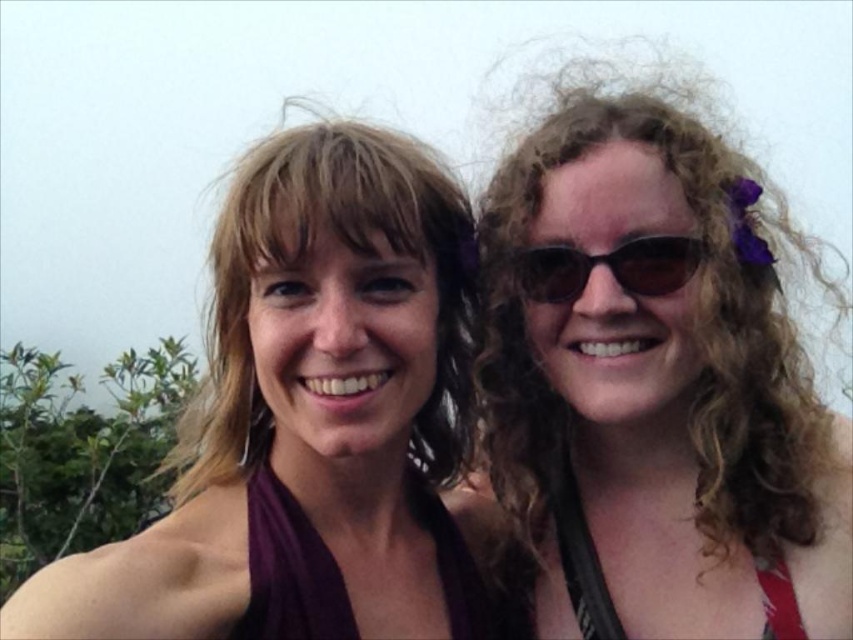
Based on the photo, does curly hair at center have a lesser height compared to black plastic sunglasses at right?

In fact, curly hair at center may be taller than black plastic sunglasses at right.

Does curly hair at center have a smaller size compared to black plastic sunglasses at right?

No.

Who is more forward, (503, 417) or (659, 296)?

Positioned in front is point (659, 296).

Locate an element on the screen. The height and width of the screenshot is (640, 853). curly hair at center is located at coordinates (654, 374).

Between curly hair at center and red fabric bikini top at right, which one appears on the right side from the viewer's perspective?

curly hair at center

Can you confirm if curly hair at center is positioned below red fabric bikini top at right?

No, curly hair at center is not below red fabric bikini top at right.

At what (x,y) coordinates should I click in order to perform the action: click on curly hair at center. Please return your answer as a coordinate pair (x, y). Looking at the image, I should click on (654, 374).

Can you confirm if matte purple dress at center is positioned above red fabric bikini top at right?

Yes.

From the picture: Who is lower down, matte purple dress at center or red fabric bikini top at right?

red fabric bikini top at right is lower down.

Who is more forward, (206, 445) or (573, 538)?

Positioned in front is point (573, 538).

At what (x,y) coordinates should I click in order to perform the action: click on matte purple dress at center. Please return your answer as a coordinate pair (x, y). Looking at the image, I should click on (312, 420).